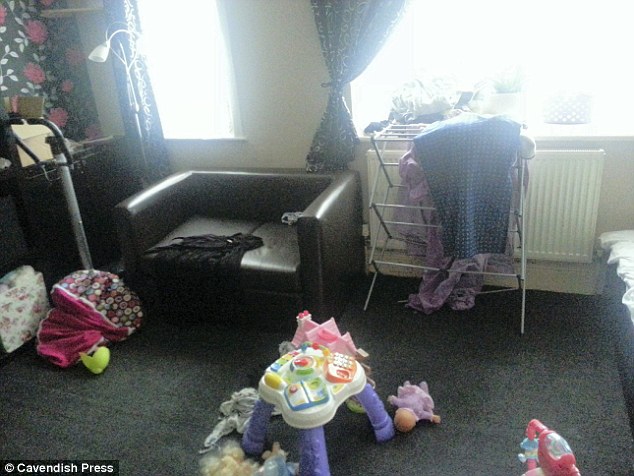
Where is `baby doll`? The image size is (634, 476). baby doll is located at coordinates (406, 407), (238, 466).